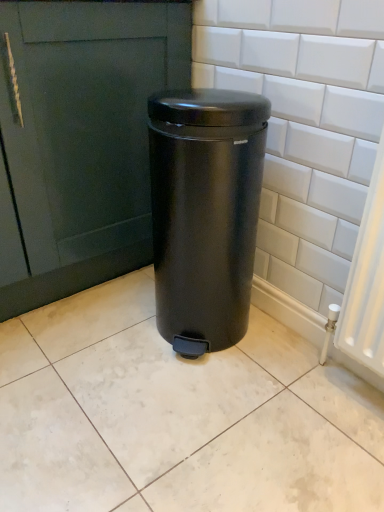
Question: Is point (233, 307) closer or farther from the camera than point (3, 397)?

Choices:
 (A) farther
 (B) closer

Answer: (A)

Question: Would you say matte black trash can at center is to the left or to the right of white glossy ceramic tile at center in the picture?

Choices:
 (A) right
 (B) left

Answer: (A)

Question: Considering the positions of matte black trash can at center and white glossy ceramic tile at center in the image, is matte black trash can at center taller or shorter than white glossy ceramic tile at center?

Choices:
 (A) tall
 (B) short

Answer: (A)

Question: Choose the correct answer: Is white glossy ceramic tile at center inside matte black trash can at center or outside it?

Choices:
 (A) inside
 (B) outside

Answer: (B)

Question: From their relative heights in the image, would you say white glossy ceramic tile at center is taller or shorter than matte black trash can at center?

Choices:
 (A) tall
 (B) short

Answer: (B)

Question: In terms of size, does white glossy ceramic tile at center appear bigger or smaller than matte black trash can at center?

Choices:
 (A) small
 (B) big

Answer: (A)

Question: From the image's perspective, is white glossy ceramic tile at center located above or below matte black trash can at center?

Choices:
 (A) below
 (B) above

Answer: (A)